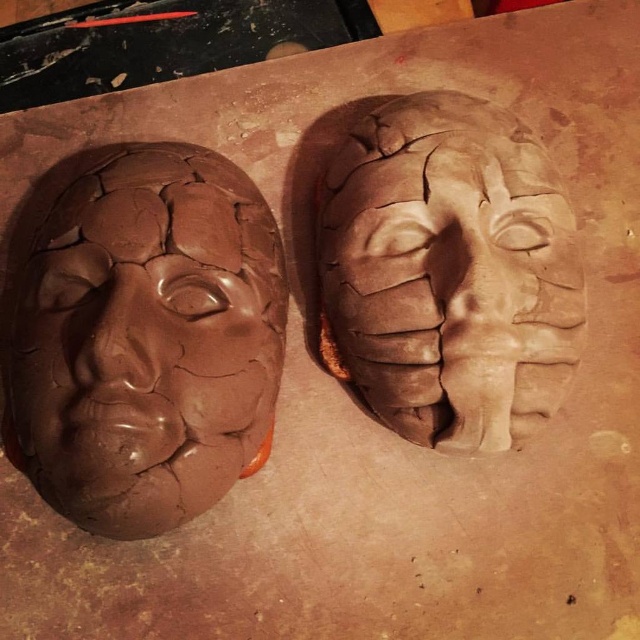
You are an artisan working on two matte clay masks. You need to place them at least 12 inches apart to prevent accidental mixing of clay. Are the matte clay mask at left and matte clay mask at center currently spaced far enough apart?

The matte clay mask at left and matte clay mask at center are 10.74 inches apart, which is less than the required 12 inches. They are too close and may risk accidental mixing of clay.

In the scene shown: You are an art student who wants to place a small brush between the matte clay mask at left and the matte clay mask at center. Can you fit it there?

The matte clay mask at left is in front of the matte clay mask at center, so there is space between them for the brush to fit.